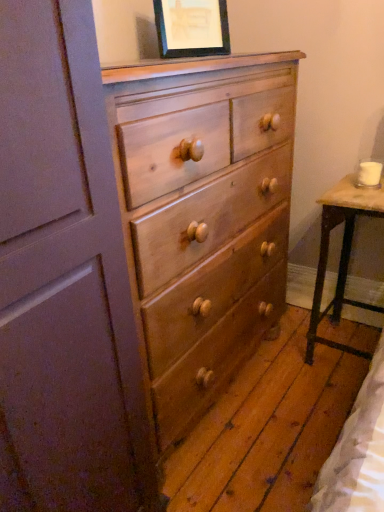
Question: Is matte black picture frame at upper center completely or partially outside of wooden table at right?

Choices:
 (A) no
 (B) yes

Answer: (B)

Question: Is matte black picture frame at upper center shorter than wooden table at right?

Choices:
 (A) no
 (B) yes

Answer: (B)

Question: Can you confirm if matte black picture frame at upper center is bigger than wooden table at right?

Choices:
 (A) yes
 (B) no

Answer: (B)

Question: Can you confirm if matte black picture frame at upper center is wider than wooden table at right?

Choices:
 (A) yes
 (B) no

Answer: (B)

Question: Does matte black picture frame at upper center come behind wooden table at right?

Choices:
 (A) no
 (B) yes

Answer: (A)

Question: Relative to wooden table at right, is light brown wood chest of drawers at center in front or behind?

Choices:
 (A) behind
 (B) front

Answer: (B)

Question: Considering the positions of light brown wood chest of drawers at center and wooden table at right in the image, is light brown wood chest of drawers at center wider or thinner than wooden table at right?

Choices:
 (A) thin
 (B) wide

Answer: (B)

Question: Visually, is light brown wood chest of drawers at center positioned to the left or to the right of wooden table at right?

Choices:
 (A) left
 (B) right

Answer: (A)

Question: In terms of height, does light brown wood chest of drawers at center look taller or shorter compared to wooden table at right?

Choices:
 (A) short
 (B) tall

Answer: (B)

Question: Based on their sizes in the image, would you say wooden table at right is bigger or smaller than light brown wood chest of drawers at center?

Choices:
 (A) small
 (B) big

Answer: (A)

Question: Is wooden table at right situated inside light brown wood chest of drawers at center or outside?

Choices:
 (A) inside
 (B) outside

Answer: (B)

Question: Is point (355, 305) positioned closer to the camera than point (195, 175)?

Choices:
 (A) farther
 (B) closer

Answer: (A)

Question: Is wooden table at right wider or thinner than light brown wood chest of drawers at center?

Choices:
 (A) thin
 (B) wide

Answer: (A)

Question: Is light brown wood chest of drawers at center to the left or to the right of matte black picture frame at upper center in the image?

Choices:
 (A) left
 (B) right

Answer: (A)

Question: Considering the positions of light brown wood chest of drawers at center and matte black picture frame at upper center in the image, is light brown wood chest of drawers at center wider or thinner than matte black picture frame at upper center?

Choices:
 (A) wide
 (B) thin

Answer: (A)